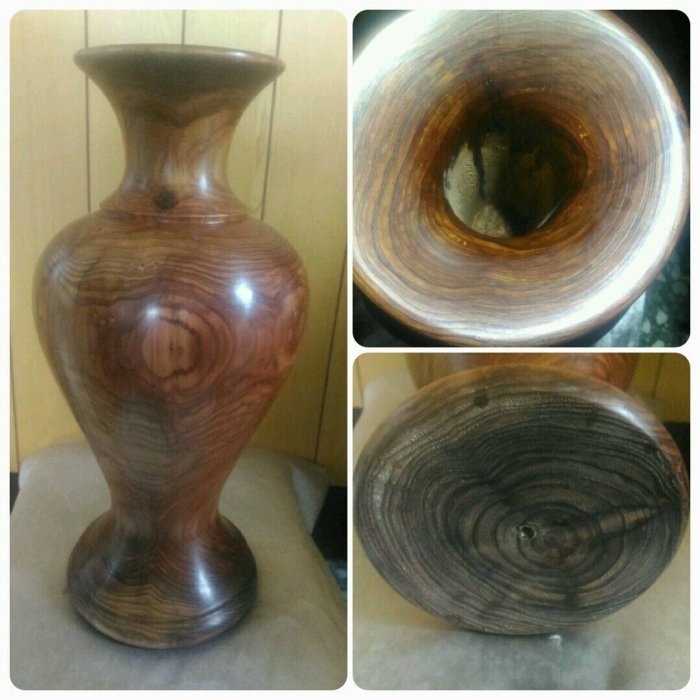
You are a GUI agent. You are given a task and a screenshot of the screen. Output one action in this format:
    pyautogui.click(x=<x>, y=<y>)
    Task: Click on the top of pot
    The width and height of the screenshot is (700, 700).
    Given the screenshot: What is the action you would take?
    pyautogui.click(x=554, y=272)